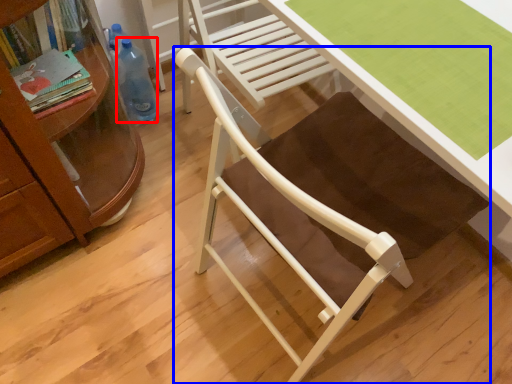
Question: Which object appears closest to the camera in this image, bottle (highlighted by a red box) or chair (highlighted by a blue box)?

Choices:
 (A) bottle
 (B) chair

Answer: (B)